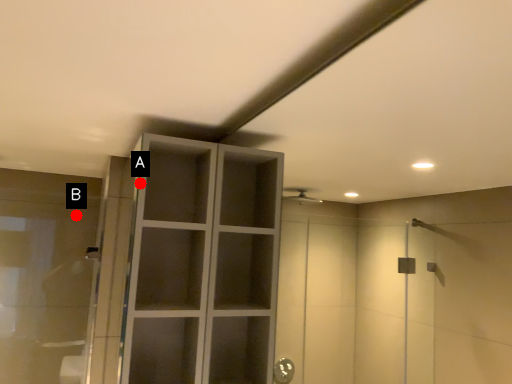
Question: Two points are circled on the image, labeled by A and B beside each circle. Which point appears farthest from the camera in this image?

Choices:
 (A) A is further
 (B) B is further

Answer: (B)